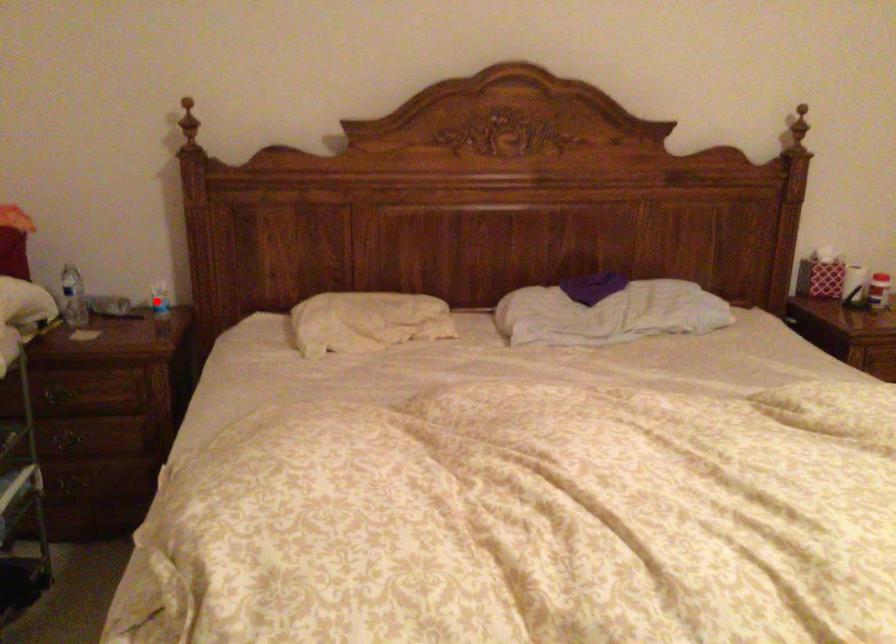
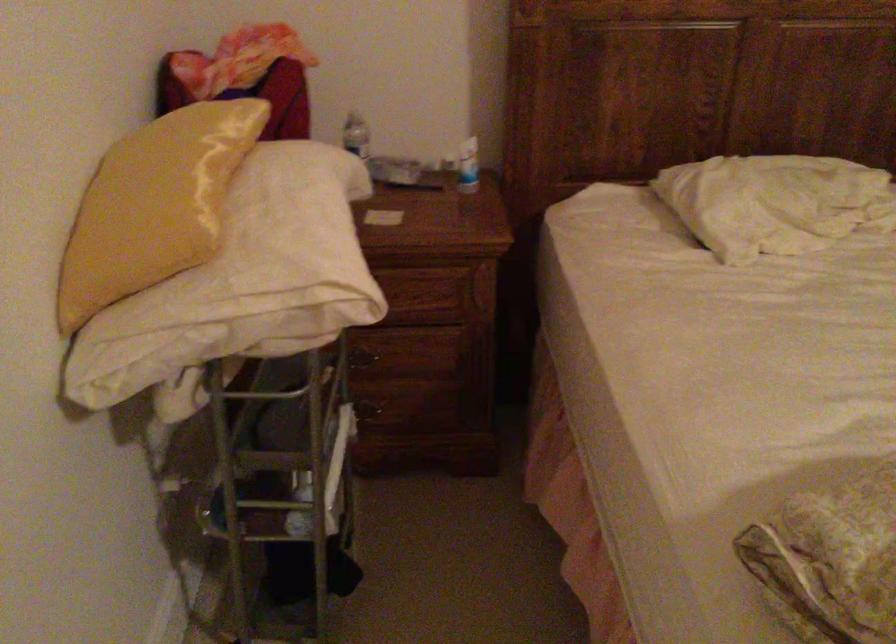
Question: I am providing you with two images of the same scene from different viewpoints. Given a red point in image1, look at the same physical point in image2. Is it:

Choices:
 (A) Closer to the viewpoint
 (B) Farther from the viewpoint

Answer: (A)